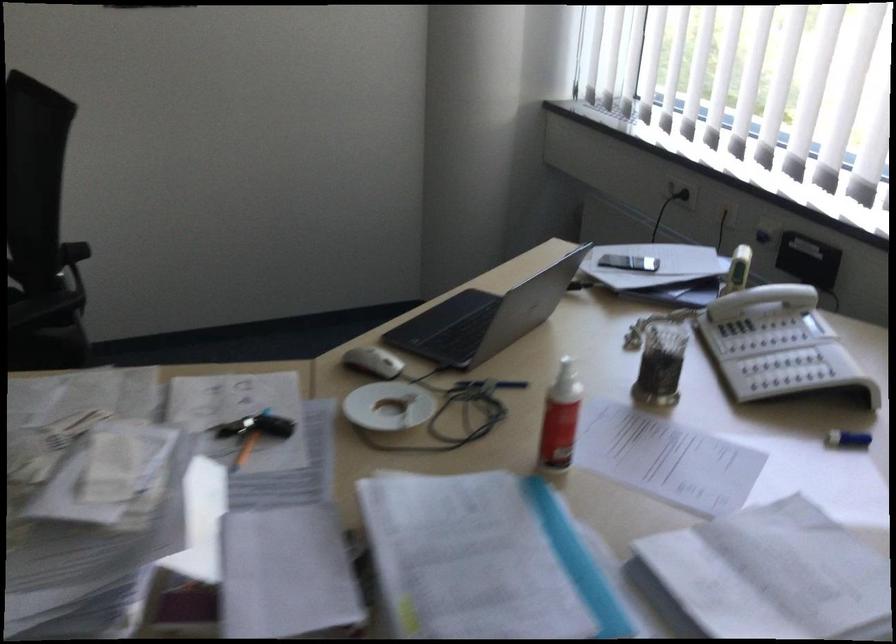
What do you see at coordinates (757, 321) in the screenshot?
I see `the white telephone handset` at bounding box center [757, 321].